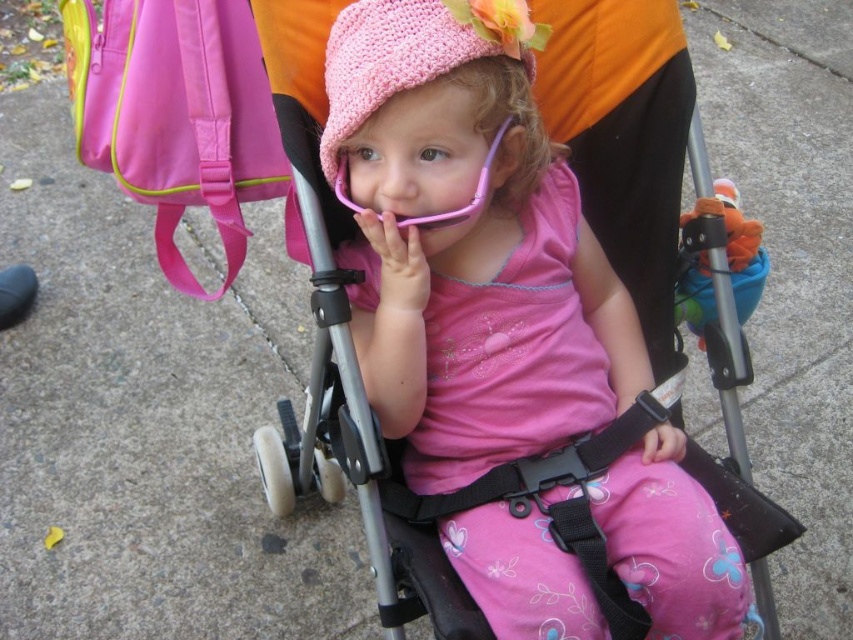
The child is wearing two hats. The pink knitted hat at center and the crochet pink hat at center. Which one is bigger?

The pink knitted hat at center is larger in size than the crochet pink hat at center.

From the picture: The user is trying to determine which hat is closer to them. They see both the pink knitted hat at center and the crochet pink hat at center. Which one is positioned closer to the observer?

The pink knitted hat at center is positioned closer to the observer as it is in front of the crochet pink hat at center.

The scene shows a child in a stroller wearing two hats. The pink knitted hat at center and the crochet pink hat at center. Which of the two hats is taller?

The pink knitted hat at center is taller than the crochet pink hat at center according to the description.